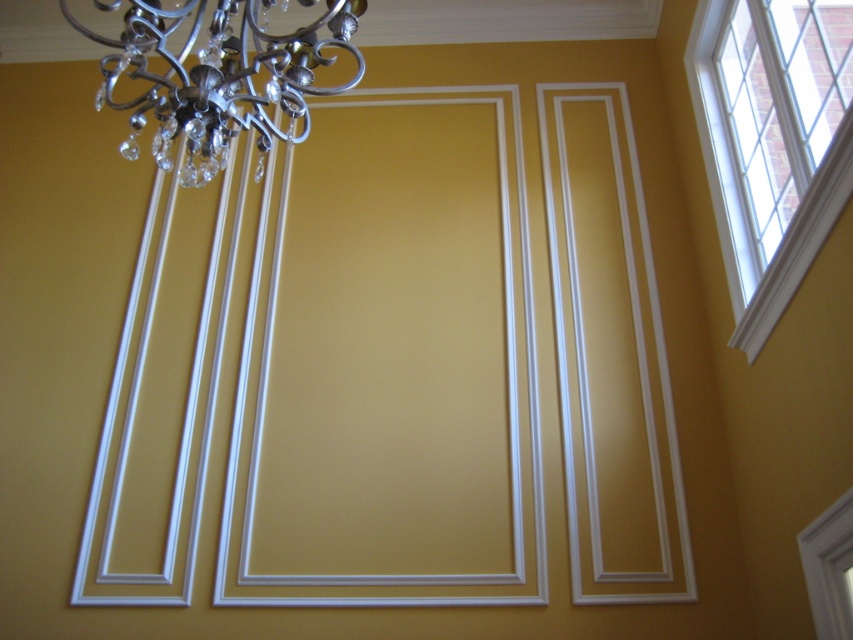
Question: Does white glass window at upper right have a lesser width compared to metallic silver chandelier at upper left?

Choices:
 (A) no
 (B) yes

Answer: (B)

Question: Is white glass window at upper right to the left of metallic silver chandelier at upper left from the viewer's perspective?

Choices:
 (A) no
 (B) yes

Answer: (A)

Question: Which point appears farthest from the camera in this image?

Choices:
 (A) coord(747,157)
 (B) coord(274,44)

Answer: (A)

Question: Which point is closer to the camera?

Choices:
 (A) (846, 12)
 (B) (207, 166)

Answer: (B)

Question: Is white glass window at upper right further to camera compared to metallic silver chandelier at upper left?

Choices:
 (A) no
 (B) yes

Answer: (B)